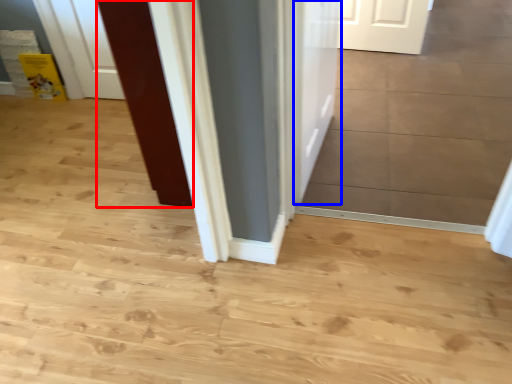
Question: Which object appears closest to the camera in this image, door (highlighted by a red box) or door (highlighted by a blue box)?

Choices:
 (A) door
 (B) door

Answer: (B)